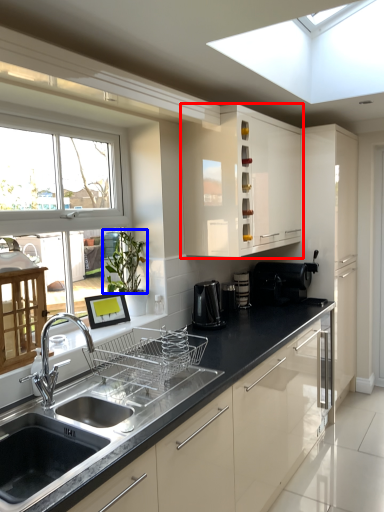
Question: Which of the following is the closest to the observer, cabinetry (highlighted by a red box) or plant (highlighted by a blue box)?

Choices:
 (A) cabinetry
 (B) plant

Answer: (B)